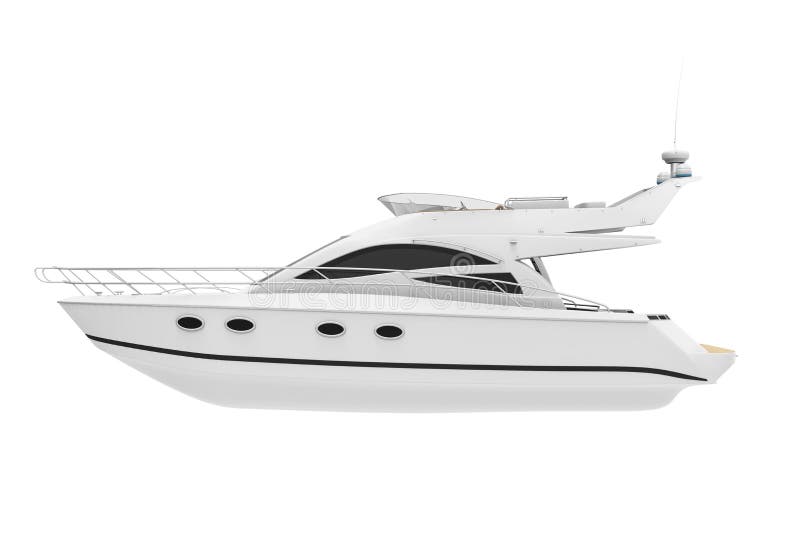
Identify the location of front window. (324, 242).